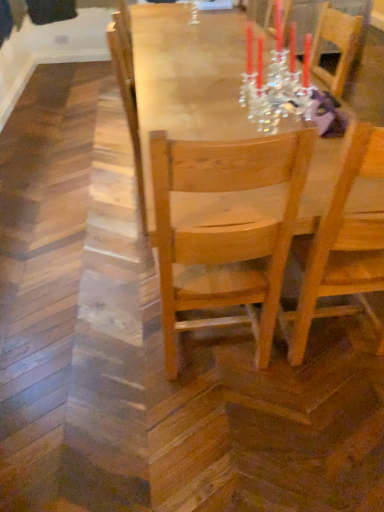
Question: Does light wood chair at center, the 2th chair positioned from the right, lie in front of wooden table at center?

Choices:
 (A) yes
 (B) no

Answer: (A)

Question: Does light wood chair at center, the 2th chair positioned from the right, contain wooden table at center?

Choices:
 (A) no
 (B) yes

Answer: (A)

Question: From a real-world perspective, is light wood chair at center, the 2th chair positioned from the right, under wooden table at center?

Choices:
 (A) yes
 (B) no

Answer: (B)

Question: Is light wood chair at center, positioned as the 1th chair in left-to-right order, touching wooden table at center?

Choices:
 (A) yes
 (B) no

Answer: (B)

Question: Considering the relative sizes of light wood chair at center, positioned as the 1th chair in left-to-right order, and wooden table at center in the image provided, is light wood chair at center, positioned as the 1th chair in left-to-right order, bigger than wooden table at center?

Choices:
 (A) no
 (B) yes

Answer: (A)

Question: Is point (168, 246) positioned closer to the camera than point (344, 253)?

Choices:
 (A) farther
 (B) closer

Answer: (B)

Question: In terms of width, does light wood chair at center, the 2th chair positioned from the right, look wider or thinner when compared to wooden chair at center, the first chair from the right?

Choices:
 (A) thin
 (B) wide

Answer: (A)

Question: Is light wood chair at center, positioned as the 1th chair in left-to-right order, in front of or behind wooden chair at center, the first chair from the right, in the image?

Choices:
 (A) front
 (B) behind

Answer: (A)

Question: In terms of height, does light wood chair at center, positioned as the 1th chair in left-to-right order, look taller or shorter compared to wooden chair at center, the second chair when ordered from left to right?

Choices:
 (A) tall
 (B) short

Answer: (A)

Question: Looking at their shapes, would you say wooden chair at center, the first chair from the right, is wider or thinner than light wood chair at center, the 2th chair positioned from the right?

Choices:
 (A) thin
 (B) wide

Answer: (B)

Question: Based on their sizes in the image, would you say wooden chair at center, the second chair when ordered from left to right, is bigger or smaller than light wood chair at center, the 2th chair positioned from the right?

Choices:
 (A) small
 (B) big

Answer: (B)

Question: From a real-world perspective, is wooden chair at center, the second chair when ordered from left to right, above or below light wood chair at center, the 2th chair positioned from the right?

Choices:
 (A) below
 (B) above

Answer: (B)

Question: Is wooden chair at center, the first chair from the right, in front of or behind light wood chair at center, the 2th chair positioned from the right, in the image?

Choices:
 (A) front
 (B) behind

Answer: (B)

Question: From a real-world perspective, relative to wooden table at center, is wooden chair at center, the first chair from the right, vertically above or below?

Choices:
 (A) below
 (B) above

Answer: (B)

Question: Is point (382, 146) positioned closer to the camera than point (225, 135)?

Choices:
 (A) farther
 (B) closer

Answer: (B)